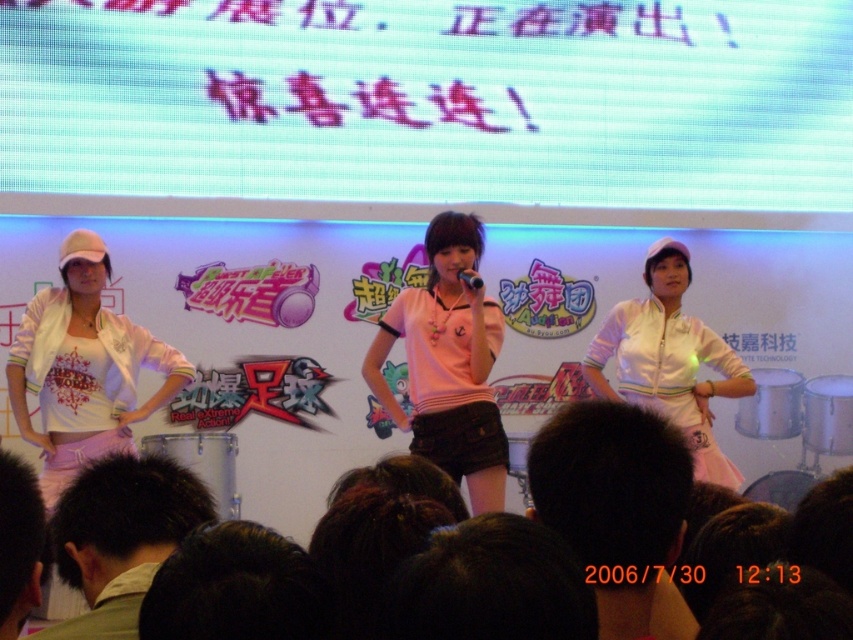
You are a sound technician in a theater. You need to adjust the microphone stand so that the black matte microphone at center is positioned closer to the light brown hair at center. Currently, the distance between them is 10.97 feet. If you move the microphone stand forward by 3 feet, will the new distance be less than 8 feet?

The current distance between light brown hair at center and black matte microphone at center is 10.97 feet. After moving the microphone stand forward by 3 feet, the new distance would be 10.97 minus 3 equals 7.97 feet, which is less than 8 feet. Therefore, yes, the new distance will be less than 8 feet.

You are a photographer at the event and want to capture a photo that includes both the light brown hair at center and the dark green hair at lower left. Based on their positions, which one should you focus on first to ensure both are in frame?

To include both the light brown hair at center and the dark green hair at lower left in the frame, focus on the dark green hair at lower left first since the light brown hair at center is to the right of it, allowing you to adjust the camera to capture both from their relative positions.

You are a stagehand preparing to adjust the lighting for the performance. You need to ensure that the white matte projection screen at upper center and the white matte jacket at left are both well illuminated. Based on their positions, which object is located higher up in the image?

The white matte projection screen at upper center is positioned over the white matte jacket at left, meaning it is higher up in the image.